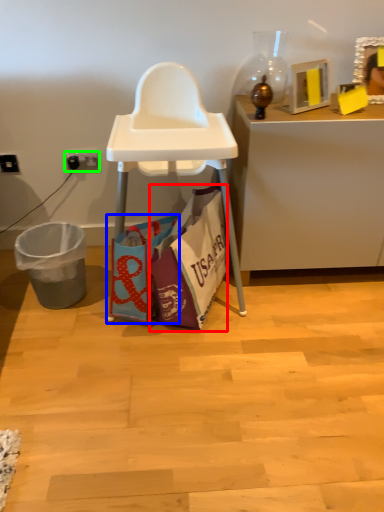
Question: Based on their relative distances, which object is farther from handbag (highlighted by a red box)? Choose from handbag (highlighted by a blue box) and power outlet (highlighted by a green box).

Choices:
 (A) handbag
 (B) power outlet

Answer: (B)